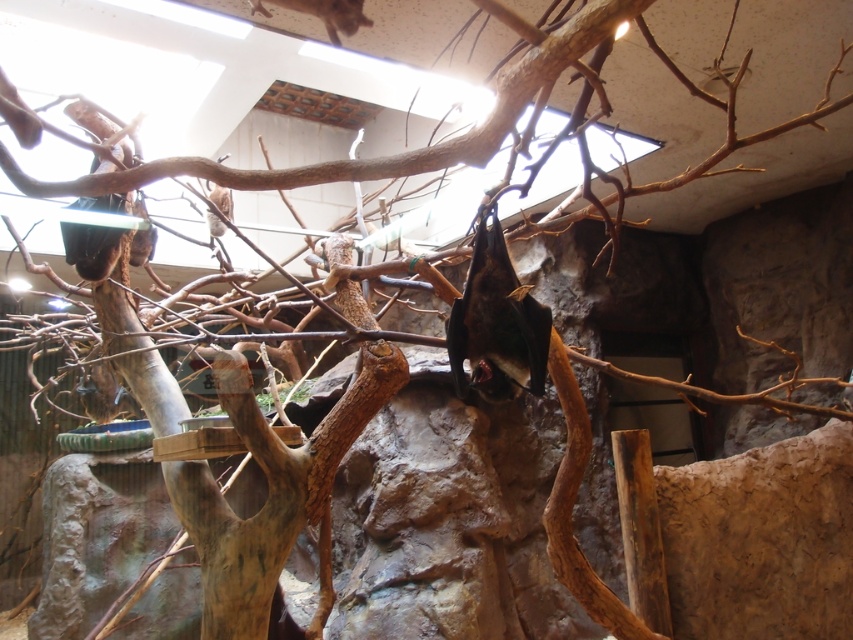
Which is behind, point (465, 307) or point (338, 40)?

Point (465, 307)

Can you confirm if dark brown fur bat at center is wider than brown fur bat at upper center?

No, dark brown fur bat at center is not wider than brown fur bat at upper center.

Between point (480, 291) and point (329, 29), which one is positioned in front?

Point (329, 29) is in front.

Locate an element on the screen. Image resolution: width=853 pixels, height=640 pixels. dark brown fur bat at center is located at coordinates (496, 323).